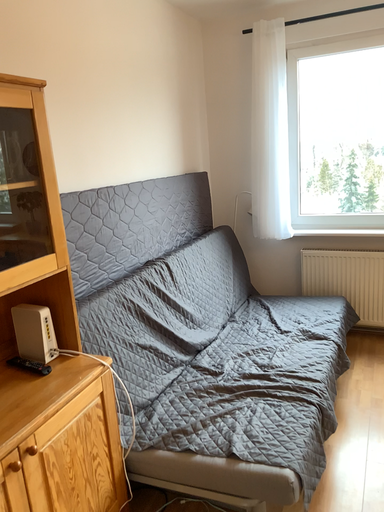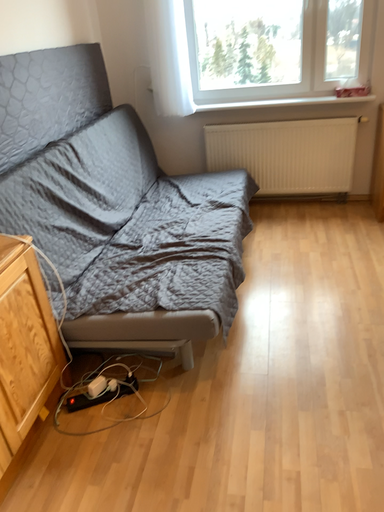
Question: How did the camera likely rotate when shooting the video?

Choices:
 (A) rotated right
 (B) rotated left

Answer: (A)